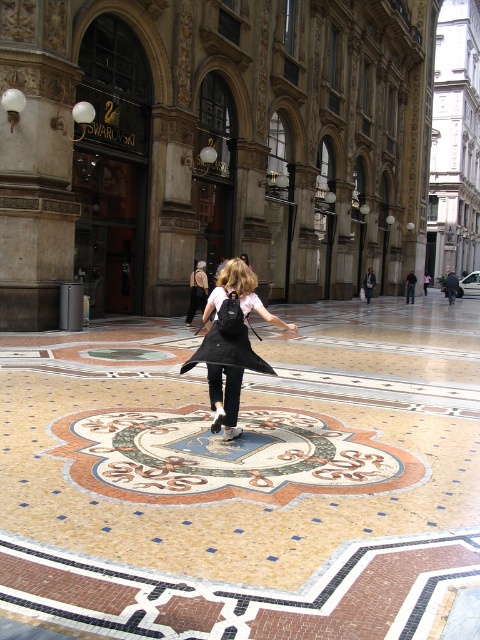
You are a photographer trying to capture the woman in the scene. You notice the black matte backpack at center and the black matte dress at center. Which object should you focus on to ensure the other is not blocking your view of the woman?

The black matte backpack at center is in front of the black matte dress at center. To ensure the woman is not blocked, focus on the black matte dress at center since it is behind the backpack.

You are a photographer trying to capture the woman in the scene. You want to ensure the black matte backpack at center and the black matte dress at center are both visible in your shot. Which object should you focus on to ensure both are in frame?

The black matte backpack at center is positioned under the black matte dress at center. Therefore, focusing on the dress will ensure the backpack is also visible since it is beneath it.

You are a fashion designer observing the woman in the image. You want to create a new outfit that complements her current attire. Considering the black matte dress at center and the black matte backpack at center, which item should you focus on first to ensure proper proportion in your design?

The black matte backpack at center has a greater height compared to the black matte dress at center, so you should focus on the black matte backpack at center first to ensure proper proportion in your design.